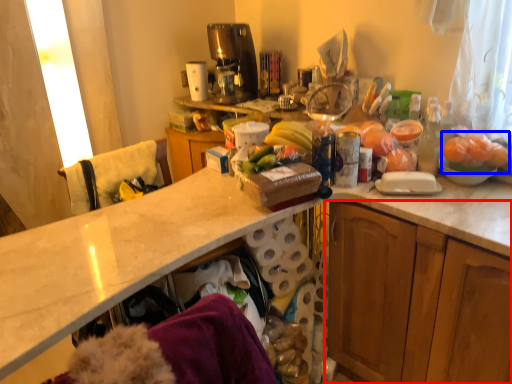
Question: Which object appears closest to the camera in this image, cabinetry (highlighted by a red box) or fruit (highlighted by a blue box)?

Choices:
 (A) cabinetry
 (B) fruit

Answer: (A)